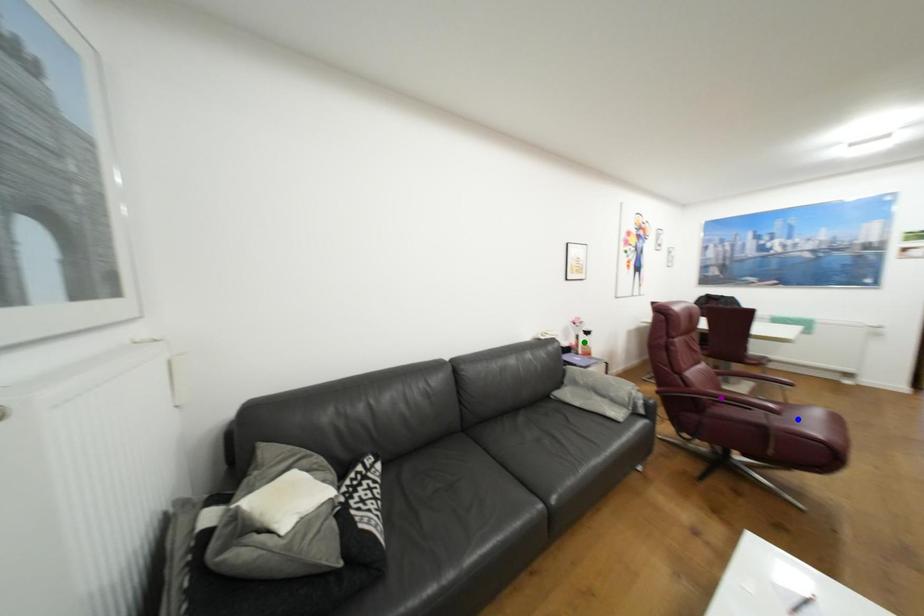
Order these from nearest to farthest:
1. purple point
2. blue point
3. green point

blue point < purple point < green point